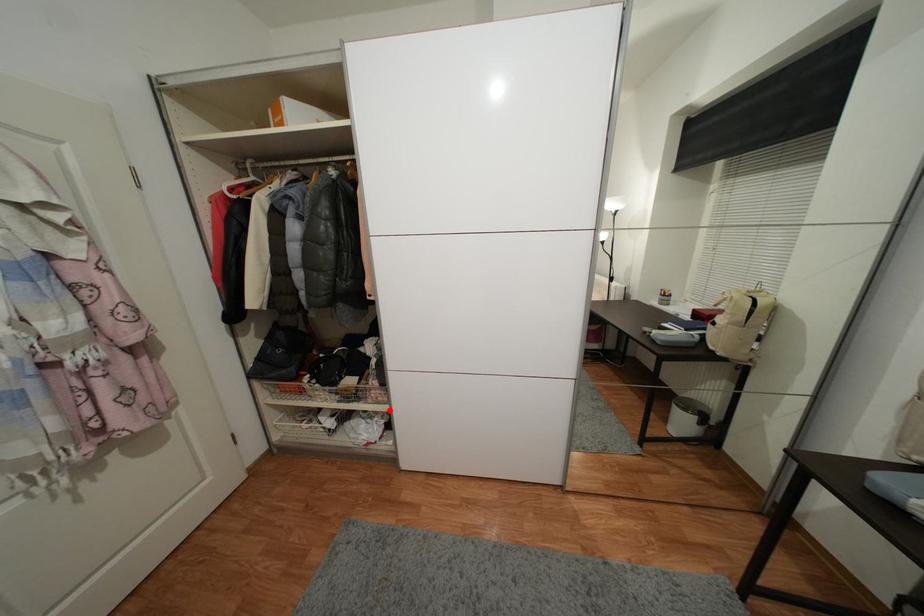
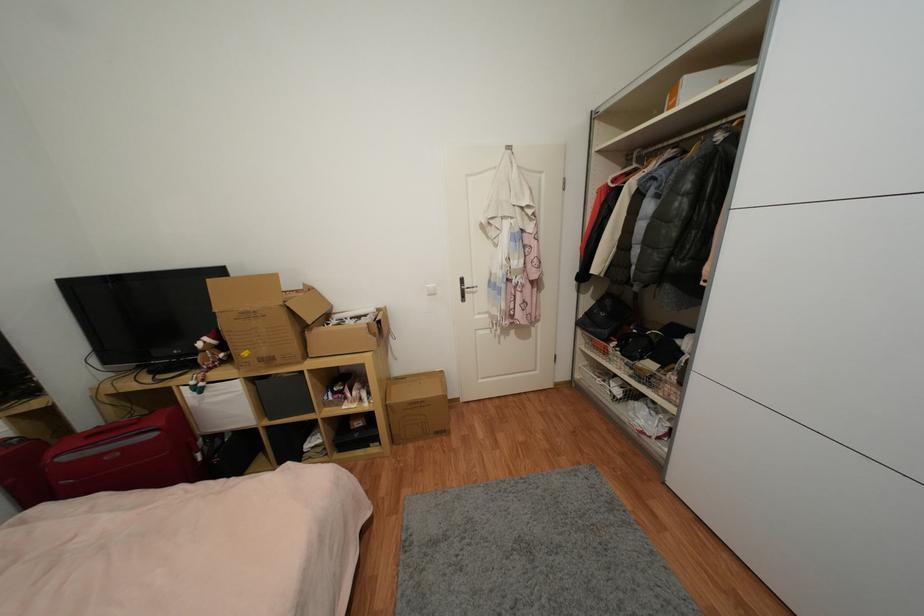
Locate, in the second image, the point that corresponds to the highlighted location in the first image.

(676, 410)